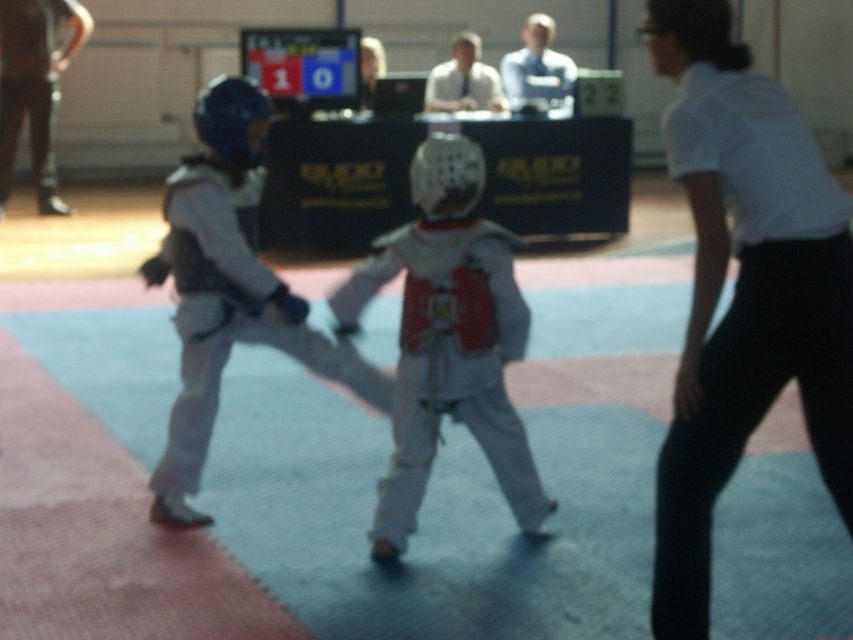
You are a judge observing the martial arts competition. You need to determine if the white matte helmet at center is larger than the white matte karate uniform at center. Based on the scene description, what is your conclusion?

The white matte helmet at center occupies less space than the white matte karate uniform at center, so the helmet is not larger than the uniform.

You are a judge in the martial arts competition. You need to determine which point is closer to the front of the mat. Which point is in front, point 1 at (416, 474) or point 2 at (300, 298)?

Point 1 at (416, 474) is in front of point 2 at (300, 298).

You are a referee in a martial arts competition. You need to ensure that the equipment is properly spaced for safety. The rule states that the helmet must be at least 70 centimeters away from the uniform during the setup. Are the white matte helmet at center and white matte karate uniform at center in compliance with the safety rule?

The white matte helmet at center is 65.91 centimeters away from the white matte karate uniform at center, which is less than the required 70 centimeters. Therefore, they are not in compliance with the safety rule.